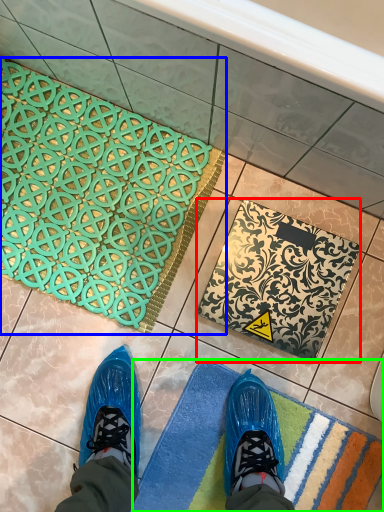
Question: Estimate the real-world distances between objects in this image. Which object is closer to bath mat (highlighted by a red box), bath mat (highlighted by a blue box) or bath mat (highlighted by a green box)?

Choices:
 (A) bath mat
 (B) bath mat

Answer: (B)